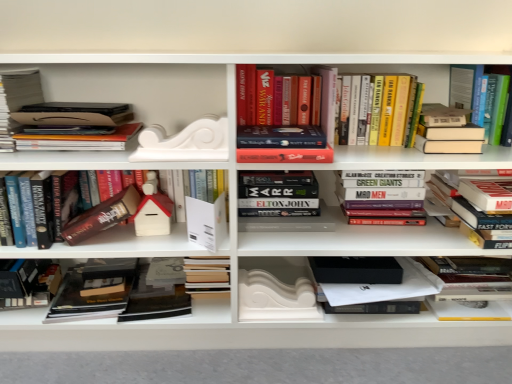
Question: Is hardcover book at upper right, placed as the tenth book when sorted from left to right, wider or thinner than hardcover book at center, which appears as the 3th paperback book when viewed from the left?

Choices:
 (A) wide
 (B) thin

Answer: (B)

Question: Is hardcover book at upper right, the 1th book viewed from the right, situated inside hardcover book at center, which appears as the 3th paperback book when viewed from the left, or outside?

Choices:
 (A) outside
 (B) inside

Answer: (A)

Question: Estimate the real-world distances between objects in this image. Which object is closer to the hardcover book at upper right, the third book positioned from the right?

Choices:
 (A) hardcover book at lower left, which appears as the first paperback book when viewed from the left
 (B) hardcover book at upper right, the 1th book viewed from the right
 (C) white matte decorative piece at center, marked as the 1th paperback book in a right-to-left arrangement
 (D) hardcover books at upper center, acting as the fifth book starting from the right
 (E) hardcover books at center, which is counted as the fourth book, starting from the right

Answer: (B)

Question: Which of these objects is positioned farthest from the hardcover book at upper right, placed as the tenth book when sorted from left to right?

Choices:
 (A) matte cardboard box at upper left, positioned as the 1th book in left-to-right order
 (B) hardcover books at upper center, acting as the fifth book starting from the right
 (C) hardcover book at center, which appears as the sixth book when viewed from the right
 (D) white matte house at center, which is the fourth book from left to right
 (E) hardcover book at lower left, which appears as the first paperback book when viewed from the left

Answer: (A)